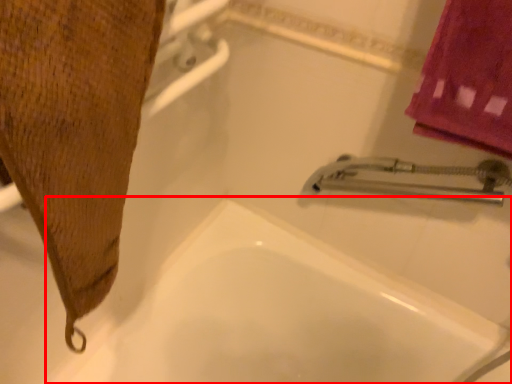
Question: Where is bath (annotated by the red box) located in relation to bath towel in the image?

Choices:
 (A) right
 (B) left

Answer: (A)